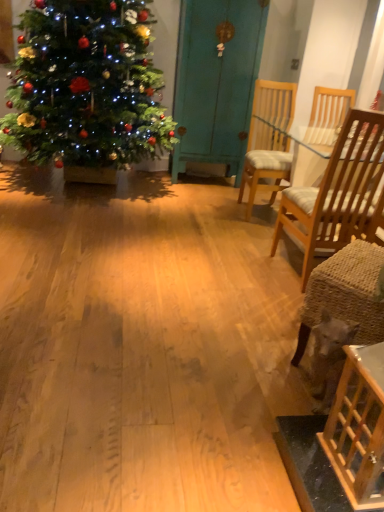
Question: Should I look upward or downward to see teal painted wood armoire at center?

Choices:
 (A) up
 (B) down

Answer: (A)

Question: In which direction should I rotate to look at wooden chair with cushion at center, positioned as the first chair in back-to-front order?

Choices:
 (A) right
 (B) left

Answer: (A)

Question: Does wooden table at lower right come in front of wooden chair with cushion at center, positioned as the first chair in back-to-front order?

Choices:
 (A) no
 (B) yes

Answer: (B)

Question: Considering the relative sizes of wooden table at lower right and wooden chair with cushion at center, marked as the second chair in a front-to-back arrangement, in the image provided, is wooden table at lower right shorter than wooden chair with cushion at center, marked as the second chair in a front-to-back arrangement,?

Choices:
 (A) yes
 (B) no

Answer: (A)

Question: Is the depth of wooden table at lower right greater than that of wooden chair with cushion at center, positioned as the first chair in back-to-front order?

Choices:
 (A) no
 (B) yes

Answer: (A)

Question: Does wooden table at lower right have a greater height compared to wooden chair with cushion at center, marked as the second chair in a front-to-back arrangement?

Choices:
 (A) no
 (B) yes

Answer: (A)

Question: Is wooden table at lower right to the right of wooden chair with cushion at center, positioned as the first chair in back-to-front order, from the viewer's perspective?

Choices:
 (A) yes
 (B) no

Answer: (B)

Question: From a real-world perspective, is wooden table at lower right located beneath wooden chair with cushion at center, positioned as the first chair in back-to-front order?

Choices:
 (A) yes
 (B) no

Answer: (A)

Question: From a real-world perspective, is wooden chair with cushion at center, marked as the second chair in a front-to-back arrangement, on light brown wood chair at right, which is the first chair from front to back?

Choices:
 (A) yes
 (B) no

Answer: (A)

Question: Is the surface of wooden chair with cushion at center, marked as the second chair in a front-to-back arrangement, in direct contact with light brown wood chair at right, which is the first chair from front to back?

Choices:
 (A) yes
 (B) no

Answer: (B)

Question: Can you confirm if wooden chair with cushion at center, marked as the second chair in a front-to-back arrangement, is smaller than light brown wood chair at right, positioned as the 2th chair in back-to-front order?

Choices:
 (A) yes
 (B) no

Answer: (A)

Question: Considering the relative sizes of wooden chair with cushion at center, positioned as the first chair in back-to-front order, and light brown wood chair at right, which is the first chair from front to back, in the image provided, is wooden chair with cushion at center, positioned as the first chair in back-to-front order, taller than light brown wood chair at right, which is the first chair from front to back,?

Choices:
 (A) no
 (B) yes

Answer: (A)

Question: Is wooden chair with cushion at center, marked as the second chair in a front-to-back arrangement, not within light brown wood chair at right, positioned as the 2th chair in back-to-front order?

Choices:
 (A) no
 (B) yes

Answer: (B)

Question: Is wooden chair with cushion at center, marked as the second chair in a front-to-back arrangement, to the left of light brown wood chair at right, positioned as the 2th chair in back-to-front order, from the viewer's perspective?

Choices:
 (A) no
 (B) yes

Answer: (B)

Question: Is teal painted wood armoire at center closer to camera compared to light brown wood chair at right, positioned as the 2th chair in back-to-front order?

Choices:
 (A) yes
 (B) no

Answer: (B)